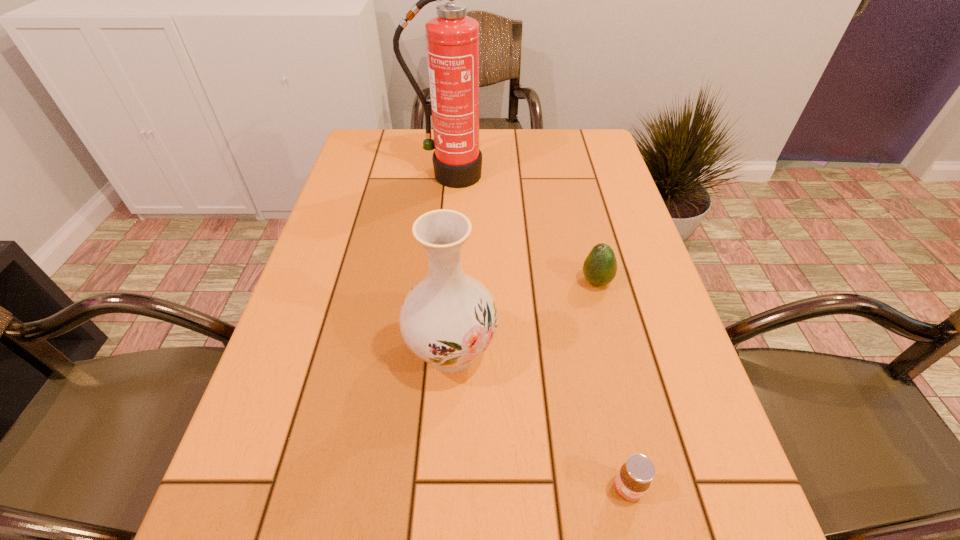
Find the location of a particular element. the farthest object is located at coordinates (452, 39).

Identify the location of the tallest object. (452, 39).

Identify the location of vase. (448, 318).

Identify the location of the third farthest object. This screenshot has height=540, width=960. (448, 318).

Locate an element on the screen. The width and height of the screenshot is (960, 540). the third nearest object is located at coordinates (600, 267).

Find the location of `the third tallest object`. the third tallest object is located at coordinates (600, 267).

Identify the location of jam. Image resolution: width=960 pixels, height=540 pixels. (634, 478).

Identify the location of the shortest object. (634, 478).

Where is `vacant area situated 0.210m on the front-facing side of the fire extinguisher`? vacant area situated 0.210m on the front-facing side of the fire extinguisher is located at coordinates (444, 239).

Where is `vacant space located 0.110m on the back of the second nearest object`? vacant space located 0.110m on the back of the second nearest object is located at coordinates (456, 278).